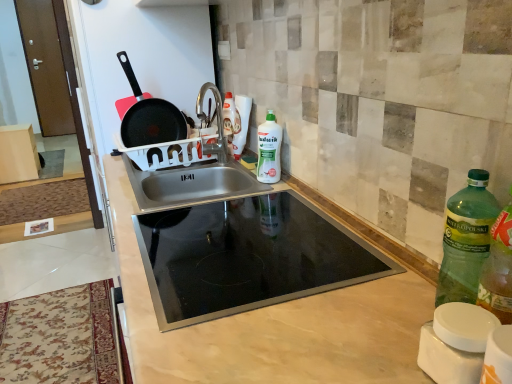
Question: Considering the relative sizes of black non-stick frying pan at upper left and green matte bottle at center, positioned as the first bottle in back-to-front order, in the image provided, is black non-stick frying pan at upper left taller than green matte bottle at center, positioned as the first bottle in back-to-front order,?

Choices:
 (A) no
 (B) yes

Answer: (B)

Question: Is black non-stick frying pan at upper left facing away from green matte bottle at center, marked as the 1th bottle in a top-to-bottom arrangement?

Choices:
 (A) yes
 (B) no

Answer: (B)

Question: From a real-world perspective, is black non-stick frying pan at upper left under green matte bottle at center, marked as the 1th bottle in a top-to-bottom arrangement?

Choices:
 (A) yes
 (B) no

Answer: (B)

Question: Considering the relative sizes of black non-stick frying pan at upper left and green matte bottle at center, which is the second bottle from front to back, in the image provided, is black non-stick frying pan at upper left bigger than green matte bottle at center, which is the second bottle from front to back,?

Choices:
 (A) no
 (B) yes

Answer: (B)

Question: Can green matte bottle at center, positioned as the first bottle in back-to-front order, be found inside black non-stick frying pan at upper left?

Choices:
 (A) yes
 (B) no

Answer: (B)

Question: Is green plastic bottle at right, marked as the 1th bottle in a bottom-to-top arrangement, in front of or behind beige marble countertop at center in the image?

Choices:
 (A) behind
 (B) front

Answer: (B)

Question: From the image's perspective, relative to beige marble countertop at center, is green plastic bottle at right, marked as the 1th bottle in a bottom-to-top arrangement, above or below?

Choices:
 (A) above
 (B) below

Answer: (A)

Question: Is point (483, 241) positioned closer to the camera than point (335, 342)?

Choices:
 (A) farther
 (B) closer

Answer: (A)

Question: Choose the correct answer: Is green plastic bottle at right, the first bottle viewed from the right, inside beige marble countertop at center or outside it?

Choices:
 (A) outside
 (B) inside

Answer: (A)

Question: From a real-world perspective, is green plastic bottle at right, marked as the 1th bottle in a bottom-to-top arrangement, positioned above or below black non-stick frying pan at upper left?

Choices:
 (A) below
 (B) above

Answer: (A)

Question: Which is correct: green plastic bottle at right, placed as the second bottle when sorted from left to right, is inside black non-stick frying pan at upper left, or outside of it?

Choices:
 (A) inside
 (B) outside

Answer: (B)

Question: Considering their positions, is green plastic bottle at right, marked as the 1th bottle in a bottom-to-top arrangement, located in front of or behind black non-stick frying pan at upper left?

Choices:
 (A) front
 (B) behind

Answer: (A)

Question: Is green plastic bottle at right, marked as the 1th bottle in a bottom-to-top arrangement, bigger or smaller than black non-stick frying pan at upper left?

Choices:
 (A) small
 (B) big

Answer: (A)

Question: Is beige marble countertop at center wider or thinner than black non-stick frying pan at upper left?

Choices:
 (A) wide
 (B) thin

Answer: (A)

Question: Considering the positions of beige marble countertop at center and black non-stick frying pan at upper left in the image, is beige marble countertop at center taller or shorter than black non-stick frying pan at upper left?

Choices:
 (A) tall
 (B) short

Answer: (A)